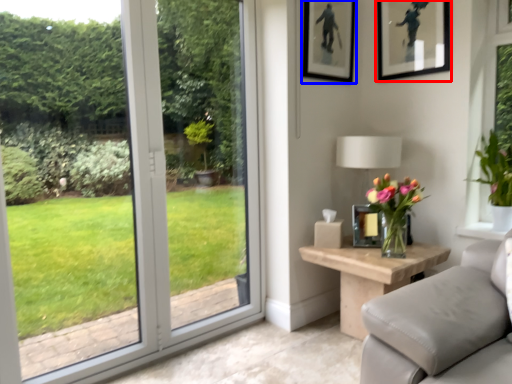
Question: Among these objects, which one is nearest to the camera, picture frame (highlighted by a red box) or picture frame (highlighted by a blue box)?

Choices:
 (A) picture frame
 (B) picture frame

Answer: (A)